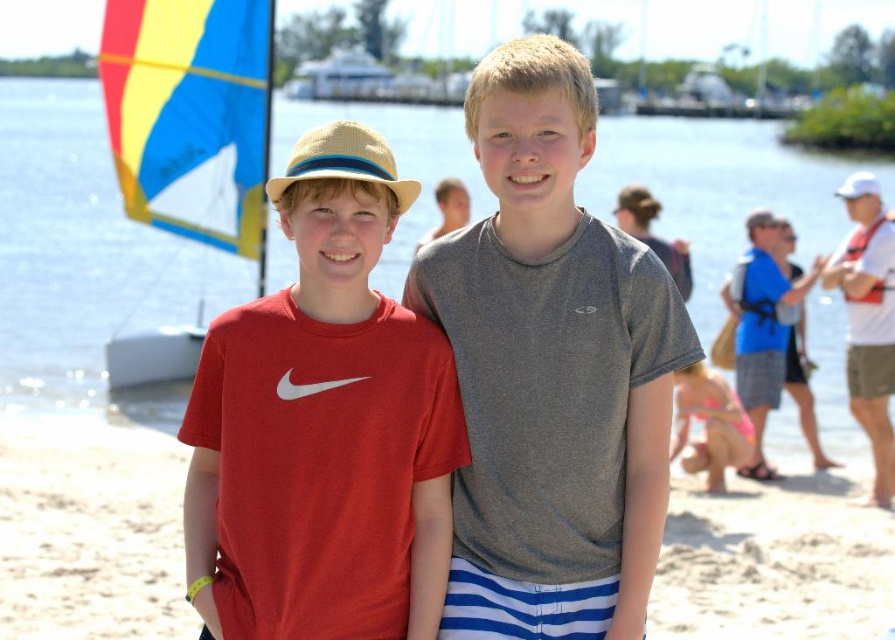
Is point (312, 349) farther from viewer compared to point (691, 579)?

No, it is in front of (691, 579).

What do you see at coordinates (322, 426) in the screenshot?
I see `matte red t-shirt at center` at bounding box center [322, 426].

Find the location of a particular element. Image resolution: width=895 pixels, height=640 pixels. matte red t-shirt at center is located at coordinates (x=322, y=426).

Does matte red t-shirt at center have a lesser height compared to transparent water at center?

Yes, matte red t-shirt at center is shorter than transparent water at center.

Between point (360, 348) and point (67, 323), which one is positioned behind?

Point (67, 323)

Is point (456, 432) closer to viewer compared to point (282, 282)?

Yes.

The width and height of the screenshot is (895, 640). What are the coordinates of `matte red t-shirt at center` in the screenshot? It's located at tap(322, 426).

Is gray heathered t-shirt at center in front of white sandy beach at center?

Yes, it is in front of white sandy beach at center.

Can you confirm if gray heathered t-shirt at center is positioned below white sandy beach at center?

Incorrect, gray heathered t-shirt at center is not positioned below white sandy beach at center.

Where is `gray heathered t-shirt at center`? This screenshot has height=640, width=895. gray heathered t-shirt at center is located at coordinates (551, 371).

You are a GUI agent. You are given a task and a screenshot of the screen. Output one action in this format:
    pyautogui.click(x=<x>, y=<y>)
    Task: Click on the gray heathered t-shirt at center
    This screenshot has width=895, height=640.
    Given the screenshot: What is the action you would take?
    pyautogui.click(x=551, y=371)